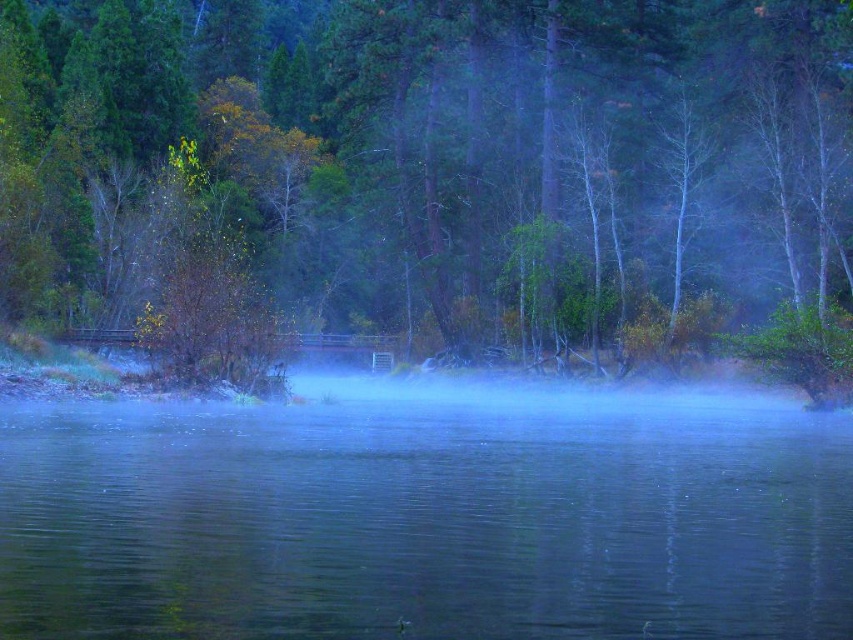
You are standing at the edge of the water and want to walk towards the green matte tree at center and the clear water at center. Which object will you reach first?

You will reach the green matte tree at center first because it is closer to you than the clear water at center, which is further away.

You are standing at the edge of the water in the scene. Which direction should you walk to reach the green matte tree at center?

The green matte tree at center is located at point 0.264 on the x and 0.524 on the y coordinate, so you should walk towards the center of the image to reach it.

You are an artist planning to paint this scene. You want to ensure the green matte tree at center and the clear water at center are proportionally accurate. Which object should you paint first to maintain scale, and why?

You should paint the green matte tree at center first because it is larger in size than the clear water at center, so establishing its scale will help you accurately size the clear water at center in relation to it.